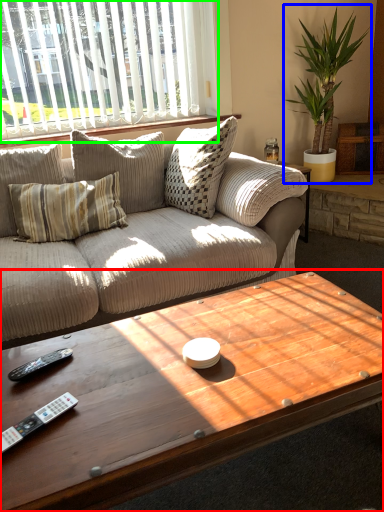
Question: Which object is positioned farthest from coffee table (highlighted by a red box)? Select from houseplant (highlighted by a blue box) and window (highlighted by a green box).

Choices:
 (A) houseplant
 (B) window

Answer: (A)